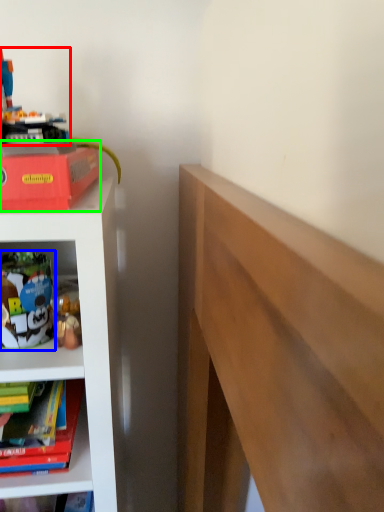
Question: Which is farther away from toy (highlighted by a red box)? toy (highlighted by a blue box) or paperback book (highlighted by a green box)?

Choices:
 (A) toy
 (B) paperback book

Answer: (A)